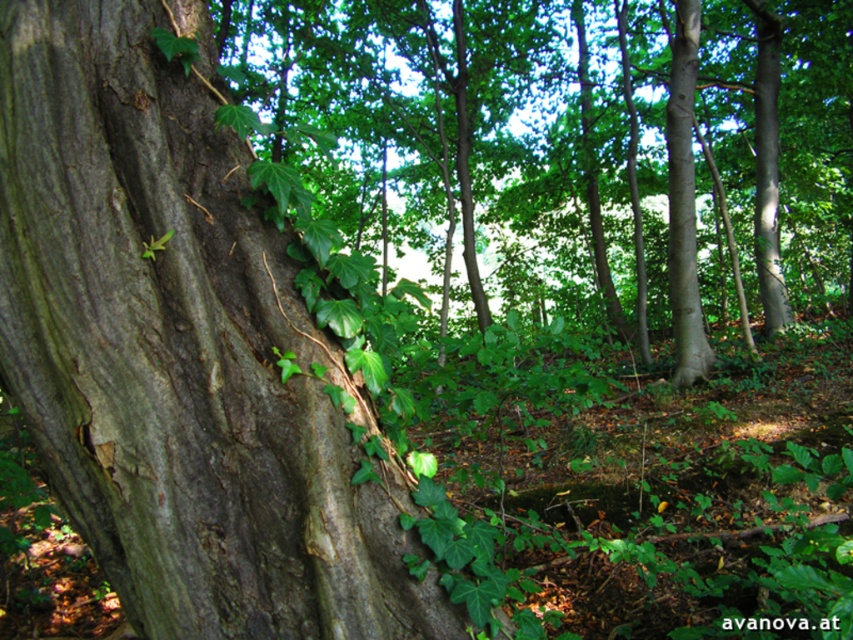
Does point (193, 237) come farther from viewer compared to point (308, 150)?

No, (193, 237) is closer to viewer.

Is smooth brown bark at left to the left of green rough bark tree at center from the viewer's perspective?

Yes, smooth brown bark at left is to the left of green rough bark tree at center.

Between point (186, 340) and point (335, 134), which one is positioned behind?

The point (335, 134) is more distant.

Where is `smooth brown bark at left`? Image resolution: width=853 pixels, height=640 pixels. smooth brown bark at left is located at coordinates (178, 349).